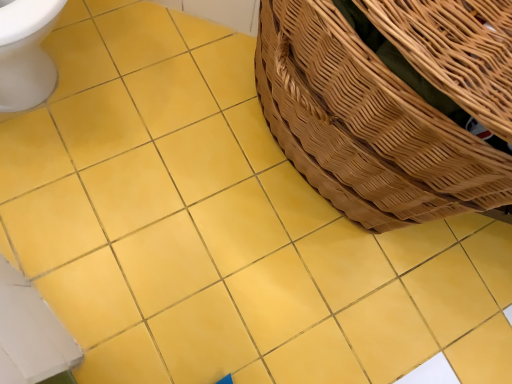
The height and width of the screenshot is (384, 512). I want to click on brown woven picnic basket at right, so click(392, 103).

Measure the distance between point (x=477, y=130) and camera.

The distance of point (x=477, y=130) from camera is 20.63 inches.

Describe the element at coordinates (392, 103) in the screenshot. I see `brown woven picnic basket at right` at that location.

You are a GUI agent. You are given a task and a screenshot of the screen. Output one action in this format:
    pyautogui.click(x=<x>, y=<y>)
    Task: Click on the brown woven picnic basket at right
    Image resolution: width=512 pixels, height=384 pixels.
    Given the screenshot: What is the action you would take?
    pyautogui.click(x=392, y=103)